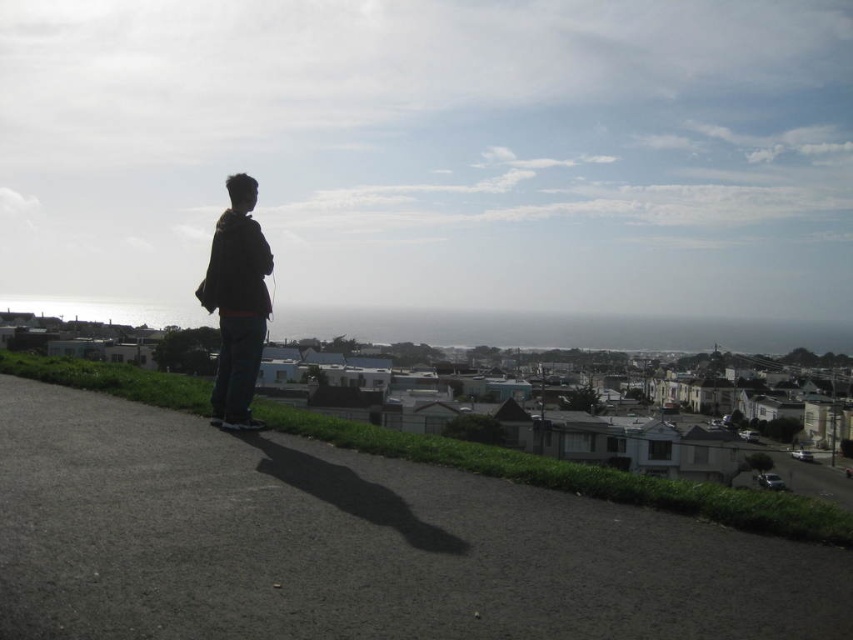
Based on the photo, is dark asphalt pavement at lower left in front of dark brown jacket at center?

That is True.

Between dark asphalt pavement at lower left and dark brown jacket at center, which one has less height?

dark asphalt pavement at lower left is shorter.

Describe the element at coordinates (352, 545) in the screenshot. This screenshot has height=640, width=853. I see `dark asphalt pavement at lower left` at that location.

Identify the location of dark asphalt pavement at lower left. The width and height of the screenshot is (853, 640). (352, 545).